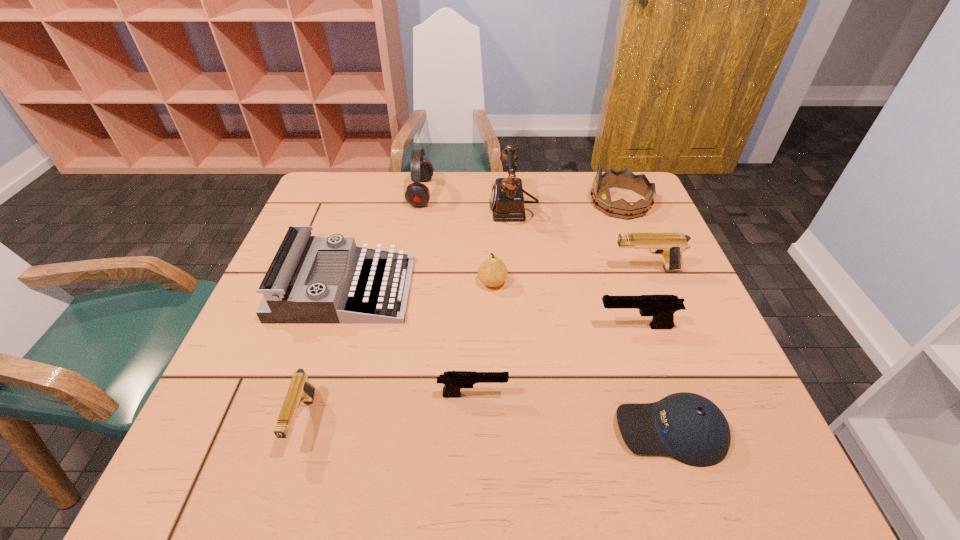
Where is `baseball cap that is at the right edge`? The width and height of the screenshot is (960, 540). baseball cap that is at the right edge is located at coordinates (689, 427).

Find the location of a particular element. This screenshot has width=960, height=540. object that is at the far right corner is located at coordinates (625, 179).

The height and width of the screenshot is (540, 960). Identify the location of object present at the near right corner. (689, 427).

Identify the location of vacant space at the far edge. (459, 179).

Image resolution: width=960 pixels, height=540 pixels. Find the location of `free space at the near edge`. free space at the near edge is located at coordinates pyautogui.click(x=398, y=477).

In the image, there is a desktop. Where is `blank space at the left edge`? blank space at the left edge is located at coordinates (312, 224).

You are a GUI agent. You are given a task and a screenshot of the screen. Output one action in this format:
    pyautogui.click(x=<x>, y=<y>)
    Task: Click on the free space at the right edge of the desktop
    
    Given the screenshot: What is the action you would take?
    pyautogui.click(x=695, y=359)

The width and height of the screenshot is (960, 540). Find the location of `free point between the baseball cap and the tiara`. free point between the baseball cap and the tiara is located at coordinates (645, 316).

Locate an element on the screen. This screenshot has width=960, height=540. empty space that is in between the pear and the red tiara is located at coordinates (556, 242).

The width and height of the screenshot is (960, 540). What are the coordinates of `free space between the black typewriter and the bigger black pistol` in the screenshot? It's located at (490, 308).